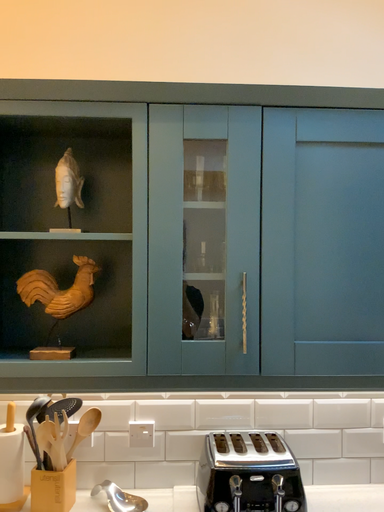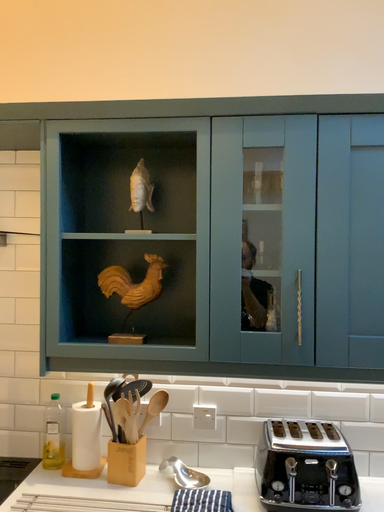
Question: How did the camera likely rotate when shooting the video?

Choices:
 (A) rotated right
 (B) rotated left

Answer: (B)